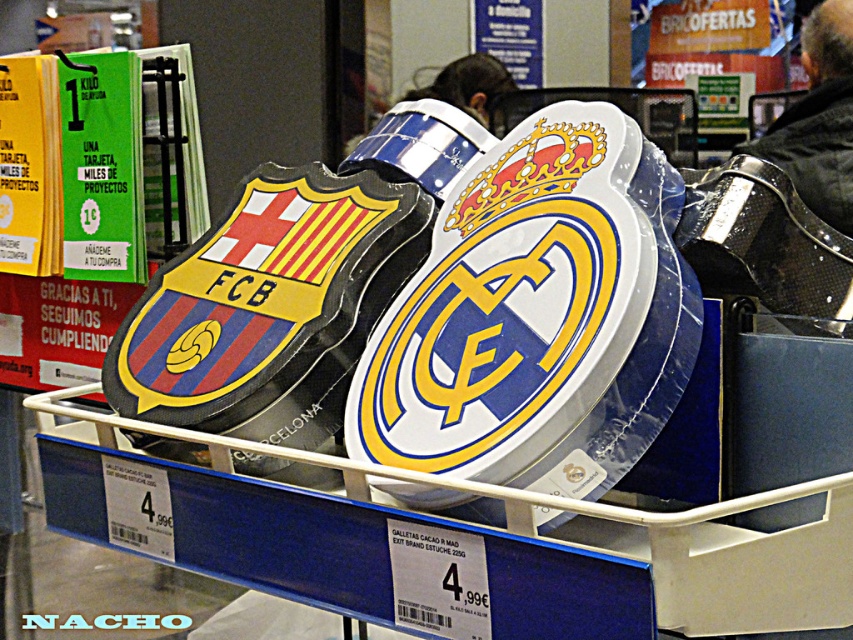
Can you confirm if white glossy shield at center is thinner than black leather jacket at upper right?

No.

Is point (624, 195) farther from camera compared to point (828, 42)?

No, (624, 195) is in front of (828, 42).

Locate an element on the screen. The image size is (853, 640). white glossy shield at center is located at coordinates (532, 308).